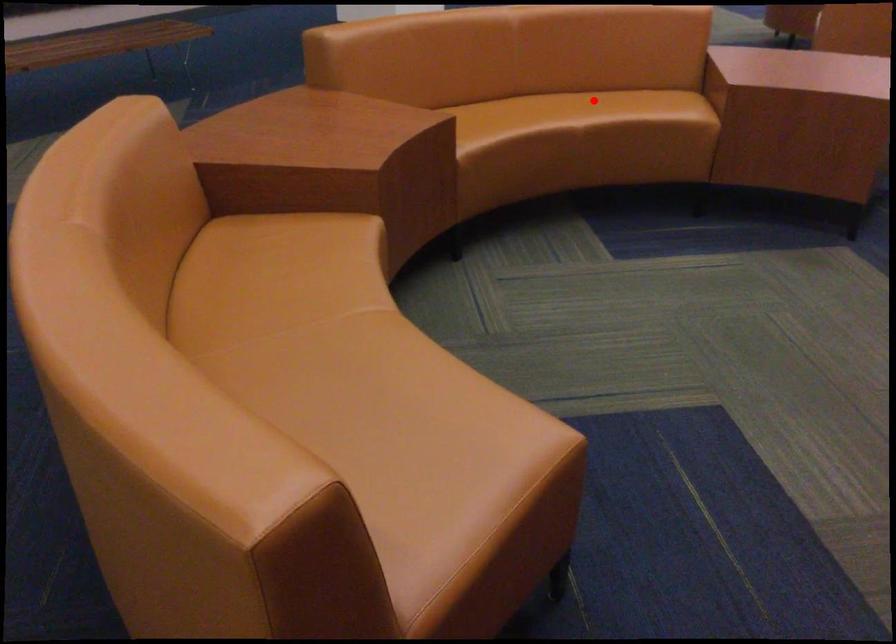
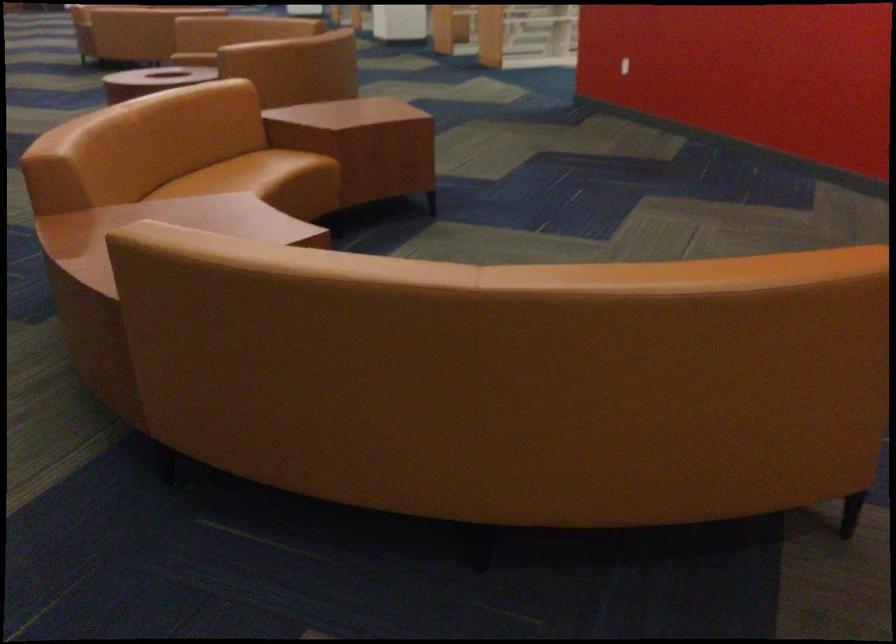
Locate, in the second image, the point that corresponds to the highlighted location in the first image.

(236, 174)